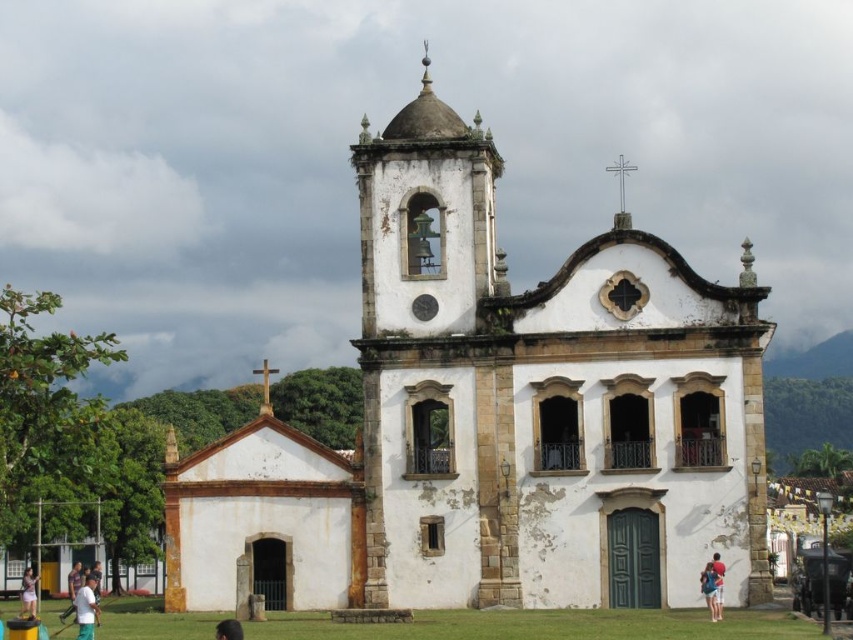
Is point (628, 577) less distant than point (712, 602)?

No, (628, 577) is behind (712, 602).

Is white stone chapel at center in front of light blue denim shorts at lower center?

No, white stone chapel at center is behind light blue denim shorts at lower center.

The width and height of the screenshot is (853, 640). I want to click on white stone chapel at center, so click(496, 419).

Does white stone chapel at center have a larger size compared to white cotton shirt at lower left?

Indeed, white stone chapel at center has a larger size compared to white cotton shirt at lower left.

Find the location of a particular element. Image resolution: width=853 pixels, height=640 pixels. white stone chapel at center is located at coordinates click(x=496, y=419).

Measure the distance from light blue shirt at lower left to light brown wooden head at lower left.

light blue shirt at lower left is 8.56 feet from light brown wooden head at lower left.

Is point (24, 586) closer to camera compared to point (68, 580)?

That is True.

Locate an element on the screen. The width and height of the screenshot is (853, 640). light blue shirt at lower left is located at coordinates (28, 593).